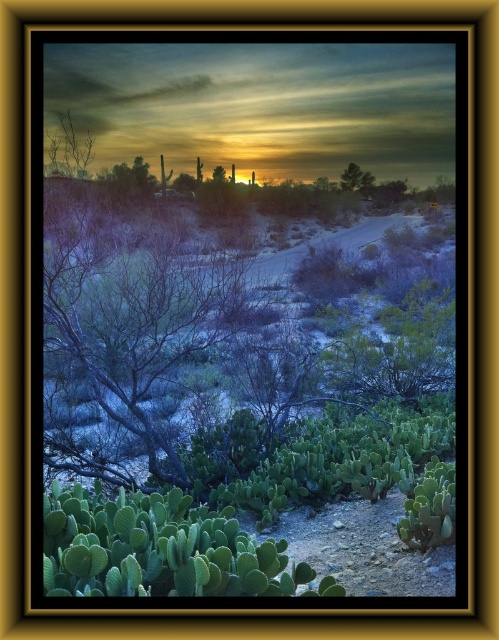
Is bare branches at upper left wider than green leafy cactus at center?

Yes.

Between bare branches at upper left and green leafy cactus at center, which one appears on the left side from the viewer's perspective?

From the viewer's perspective, bare branches at upper left appears more on the left side.

The width and height of the screenshot is (499, 640). Find the location of `bare branches at upper left`. bare branches at upper left is located at coordinates (69, 150).

Who is lower down, bare branches at upper left or green leafy tree at upper center?

bare branches at upper left is below.

Does point (49, 145) come in front of point (360, 184)?

Yes, it is.

Is point (60, 113) closer to camera compared to point (351, 189)?

Yes, it is in front of point (351, 189).

Where is `bare branches at upper left`? bare branches at upper left is located at coordinates (69, 150).

Who is more distant from viewer, (362, 173) or (222, 179)?

Point (362, 173)

Between green leafy tree at upper center and green leafy cactus at center, which one has more height?

green leafy tree at upper center is taller.

Which is in front, point (351, 186) or point (223, 179)?

Point (223, 179)

Identify the location of green leafy tree at upper center. The height and width of the screenshot is (640, 499). (351, 177).